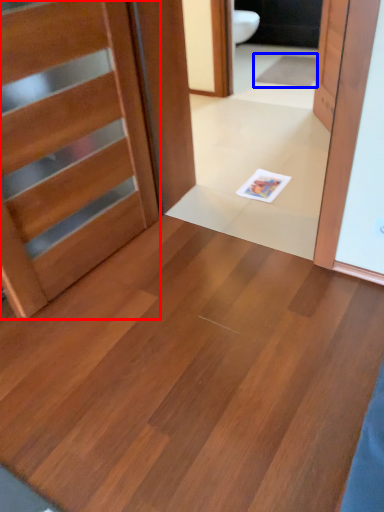
Question: Which object is further to the camera taking this photo, door (highlighted by a red box) or doormat (highlighted by a blue box)?

Choices:
 (A) door
 (B) doormat

Answer: (B)